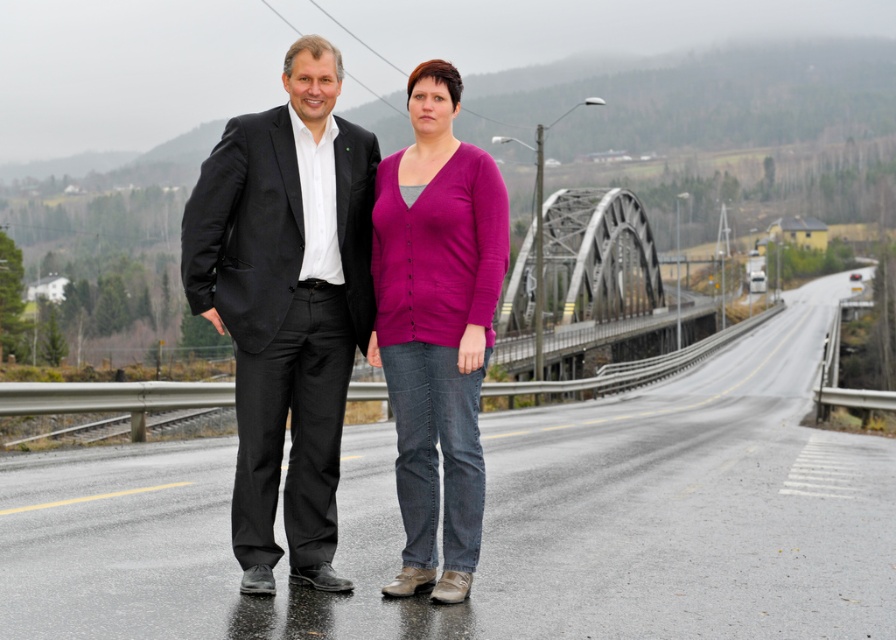
Question: Can you confirm if asphalt road at center is bigger than purple cardigan at center?

Choices:
 (A) yes
 (B) no

Answer: (A)

Question: In this image, where is purple cardigan at center located relative to steel bridge at center?

Choices:
 (A) right
 (B) left

Answer: (B)

Question: Which object is positioned farthest from the purple cardigan at center?

Choices:
 (A) matte black suit at center
 (B) steel bridge at center

Answer: (B)

Question: In this image, where is asphalt road at center located relative to matte black suit at center?

Choices:
 (A) right
 (B) left

Answer: (A)

Question: Which object appears farthest from the camera in this image?

Choices:
 (A) steel bridge at center
 (B) matte black suit at center
 (C) asphalt road at center

Answer: (A)

Question: Estimate the real-world distances between objects in this image. Which object is closer to the steel bridge at center?

Choices:
 (A) matte black suit at center
 (B) asphalt road at center

Answer: (B)